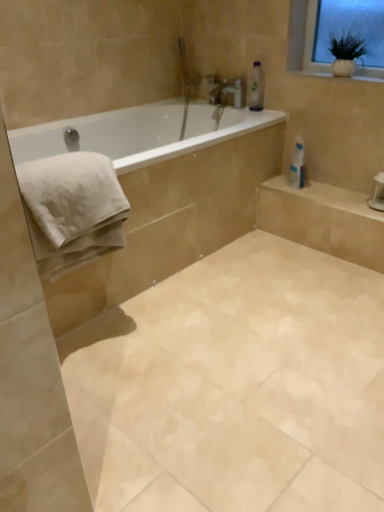
What do you see at coordinates (367, 74) in the screenshot? I see `white ceramic vase at upper right` at bounding box center [367, 74].

Where is `white matte towel at left`? This screenshot has width=384, height=512. white matte towel at left is located at coordinates (169, 196).

The height and width of the screenshot is (512, 384). What are the coordinates of `white cotton towel at left` in the screenshot? It's located at (72, 209).

Where is `clear plastic bottle at upper center`? The width and height of the screenshot is (384, 512). clear plastic bottle at upper center is located at coordinates (x=256, y=87).

Considering the positions of objects clear plastic bottle at upper center and white cotton towel at left in the image provided, who is behind, clear plastic bottle at upper center or white cotton towel at left?

clear plastic bottle at upper center is further from the camera.

Consider the image. Considering the sizes of clear plastic bottle at upper center and white cotton towel at left in the image, is clear plastic bottle at upper center taller or shorter than white cotton towel at left?

In the image, clear plastic bottle at upper center appears to be shorter than white cotton towel at left.

Between point (256, 96) and point (69, 165), which one is positioned behind?

The point (256, 96) is farther.

From the image's perspective, is white matte towel at left positioned above or below white glossy toilet paper at upper right?

white matte towel at left is situated lower than white glossy toilet paper at upper right in the image.

From the picture: Is white glossy toilet paper at upper right a part of white matte towel at left?

No, white matte towel at left does not contain white glossy toilet paper at upper right.

From a real-world perspective, between white matte towel at left and white glossy toilet paper at upper right, who is vertically higher?

In real-world perspective, white glossy toilet paper at upper right is above.

Is white matte towel at left in front of or behind white glossy toilet paper at upper right in the image?

white matte towel at left is in front of white glossy toilet paper at upper right.

Between white glossy soap dispenser at upper right and white cotton towel at left, which one has larger size?

white cotton towel at left is bigger.

Would you consider white glossy soap dispenser at upper right to be distant from white cotton towel at left?

That's right, there is a large distance between white glossy soap dispenser at upper right and white cotton towel at left.

Is white cotton towel at left at the back of white glossy soap dispenser at upper right?

white glossy soap dispenser at upper right does not have its back to white cotton towel at left.

Considering the sizes of white glossy soap dispenser at upper right and white cotton towel at left in the image, is white glossy soap dispenser at upper right taller or shorter than white cotton towel at left?

white glossy soap dispenser at upper right is shorter than white cotton towel at left.

Considering the points (28, 188) and (280, 178), which point is behind, point (28, 188) or point (280, 178)?

Positioned behind is point (280, 178).

Considering the sizes of objects white cotton towel at left and white glossy soap dispenser at upper right in the image provided, who is wider, white cotton towel at left or white glossy soap dispenser at upper right?

Wider between the two is white cotton towel at left.

Based on the photo, would you say white cotton towel at left is inside or outside white glossy soap dispenser at upper right?

white cotton towel at left lies outside white glossy soap dispenser at upper right.

From a real-world perspective, is white glossy soap dispenser at upper right above or below white ceramic vase at upper right?

white glossy soap dispenser at upper right is situated lower than white ceramic vase at upper right in the real world.

Does white glossy soap dispenser at upper right turn towards white ceramic vase at upper right?

No, white glossy soap dispenser at upper right is not aimed at white ceramic vase at upper right.

Is white glossy soap dispenser at upper right completely or partially outside of white ceramic vase at upper right?

Indeed, white glossy soap dispenser at upper right is completely outside white ceramic vase at upper right.

In the scene shown: Is white glossy soap dispenser at upper right at the left side of white ceramic vase at upper right?

Yes.

Is beige marble tile at center inside the boundaries of white matte towel at left, or outside?

beige marble tile at center is spatially situated outside white matte towel at left.

From a real-world perspective, which object stands above the other?

In real-world perspective, white matte towel at left is above.

Is beige marble tile at center shorter than white matte towel at left?

Yes.

Which object is positioned more to the right, white matte towel at left or beige marble tile at center?

From the viewer's perspective, beige marble tile at center appears more on the right side.

Find the location of `ceramic tile below the white matte towel at left (from the image's perspective)`. ceramic tile below the white matte towel at left (from the image's perspective) is located at coordinates click(235, 386).

Is white matte towel at left oriented away from beige marble tile at center?

white matte towel at left is not turned away from beige marble tile at center.

Which is in front, white matte towel at left or beige marble tile at center?

beige marble tile at center is more forward.

Where is `bath towel below the clear plastic bottle at upper center (from the image's perspective)`? This screenshot has height=512, width=384. bath towel below the clear plastic bottle at upper center (from the image's perspective) is located at coordinates (72, 209).

Identify the location of bath that is in front of the white glossy toilet paper at upper right. (169, 196).

Estimate the real-world distances between objects in this image. Which object is closer to white matte towel at left, white glossy toilet paper at upper right or white cotton towel at left?

The object closer to white matte towel at left is white cotton towel at left.

From the picture: Which object lies nearer to the anchor point white glossy toilet paper at upper right, white ceramic vase at upper right or white cotton towel at left?

Among the two, white ceramic vase at upper right is located nearer to white glossy toilet paper at upper right.

Considering their positions, is beige marble tile at center positioned closer to white glossy toilet paper at upper right than white ceramic vase at upper right?

white ceramic vase at upper right is closer to white glossy toilet paper at upper right.

In the scene shown: Looking at the image, which one is located closer to white cotton towel at left, beige marble tile at center or white ceramic vase at upper right?

Among the two, beige marble tile at center is located nearer to white cotton towel at left.

Considering their positions, is white glossy soap dispenser at upper right positioned further to beige marble tile at center than white cotton towel at left?

Among the two, white glossy soap dispenser at upper right is located further to beige marble tile at center.

Which object lies nearer to the anchor point clear plastic bottle at upper center, white cotton towel at left or white glossy soap dispenser at upper right?

Based on the image, white glossy soap dispenser at upper right appears to be nearer to clear plastic bottle at upper center.

Looking at the image, which one is located further to beige marble tile at center, white ceramic vase at upper right or white glossy toilet paper at upper right?

white ceramic vase at upper right lies further to beige marble tile at center than the other object.

Which object lies further to the anchor point white ceramic vase at upper right, white glossy soap dispenser at upper right or clear plastic bottle at upper center?

white glossy soap dispenser at upper right is positioned further to the anchor white ceramic vase at upper right.

Identify the location of bath between white cotton towel at left and white glossy toilet paper at upper right. (169, 196).

This screenshot has height=512, width=384. Identify the location of balustrade between beige marble tile at center and clear plastic bottle at upper center from front to back. (327, 197).

The image size is (384, 512). I want to click on toilet paper situated between white cotton towel at left and white glossy soap dispenser at upper right from left to right, so click(x=297, y=165).

Where is `bath between beige marble tile at center and clear plastic bottle at upper center along the z-axis`? The image size is (384, 512). bath between beige marble tile at center and clear plastic bottle at upper center along the z-axis is located at coordinates (169, 196).